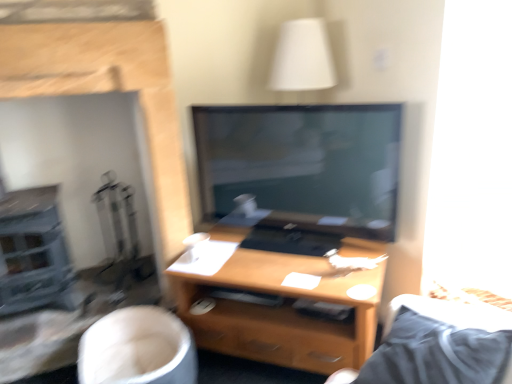
Image resolution: width=512 pixels, height=384 pixels. What are the coordinates of `white fabric swivel chair at lower left` in the screenshot? It's located at click(137, 348).

You are a GUI agent. You are given a task and a screenshot of the screen. Output one action in this format:
    pyautogui.click(x=<x>, y=<y>)
    Task: Click on the wooden desk at center
    This screenshot has width=512, height=384.
    Given the screenshot: What is the action you would take?
    pyautogui.click(x=281, y=312)

Considering the positions of points (165, 238) and (275, 328), is point (165, 238) farther from camera compared to point (275, 328)?

Yes, it is behind point (275, 328).

From a real-world perspective, is smooth stone fireplace at left above or below wooden desk at center?

From a real-world perspective, smooth stone fireplace at left is physically above wooden desk at center.

Would you consider smooth stone fireplace at left to be distant from wooden desk at center?

No, smooth stone fireplace at left is not far from wooden desk at center.

Would you say smooth stone fireplace at left is outside wooden desk at center?

Absolutely, smooth stone fireplace at left is external to wooden desk at center.

From a real-world perspective, which is physically below, wooden desk at center or smooth stone fireplace at left?

From a 3D spatial view, wooden desk at center is below.

Choose the correct answer: Is wooden desk at center inside smooth stone fireplace at left or outside it?

wooden desk at center is located beyond the bounds of smooth stone fireplace at left.

Between wooden desk at center and smooth stone fireplace at left, which one has more height?

smooth stone fireplace at left.

Where is `desk on the right of smooth stone fireplace at left`? This screenshot has height=384, width=512. desk on the right of smooth stone fireplace at left is located at coordinates (281, 312).

Between smooth stone fireplace at left and white fabric swivel chair at lower left, which one has less height?

With less height is white fabric swivel chair at lower left.

Is point (19, 34) positioned before point (170, 382)?

Yes.

How different are the orientations of smooth stone fireplace at left and white fabric swivel chair at lower left in degrees?

The angular difference between smooth stone fireplace at left and white fabric swivel chair at lower left is 1.95 degrees.

Is smooth stone fireplace at left looking in the opposite direction of white fabric swivel chair at lower left?

No, smooth stone fireplace at left's orientation is not away from white fabric swivel chair at lower left.

From a real-world perspective, is wooden desk at center positioned over white fabric swivel chair at lower left based on gravity?

Yes, from a real-world perspective, wooden desk at center is over white fabric swivel chair at lower left

Is wooden desk at center shorter than white fabric swivel chair at lower left?

No.

Is wooden desk at center located outside white fabric swivel chair at lower left?

Yes, wooden desk at center is located beyond the bounds of white fabric swivel chair at lower left.

Which object is more forward, wooden desk at center or white fabric swivel chair at lower left?

white fabric swivel chair at lower left is more forward.

Is white fabric swivel chair at lower left wider or thinner than wooden desk at center?

white fabric swivel chair at lower left is thinner than wooden desk at center.

Considering the relative sizes of white fabric swivel chair at lower left and wooden desk at center in the image provided, is white fabric swivel chair at lower left shorter than wooden desk at center?

Yes.

Considering their positions, is white fabric swivel chair at lower left located in front of or behind wooden desk at center?

white fabric swivel chair at lower left is positioned closer to the viewer than wooden desk at center.

Is white fabric swivel chair at lower left with wooden desk at center?

No.

Is white fabric swivel chair at lower left placed right next to smooth stone fireplace at left?

There is a gap between white fabric swivel chair at lower left and smooth stone fireplace at left.

Find the location of a particular element. Image resolution: width=512 pixels, height=384 pixels. fireplace that appears above the white fabric swivel chair at lower left (from a real-world perspective) is located at coordinates (109, 91).

From a real-world perspective, is white fabric swivel chair at lower left beneath smooth stone fireplace at left?

Yes, from a real-world perspective, white fabric swivel chair at lower left is below smooth stone fireplace at left.

Find the location of a particular element. The width and height of the screenshot is (512, 384). desk on the right of smooth stone fireplace at left is located at coordinates pos(281,312).

The image size is (512, 384). What are the coordinates of `desk that is below the smooth stone fireplace at left (from the image's perspective)` in the screenshot? It's located at (281, 312).

Looking at the image, which one is located further to smooth stone fireplace at left, wooden desk at center or white fabric swivel chair at lower left?

Among the two, wooden desk at center is located further to smooth stone fireplace at left.

Estimate the real-world distances between objects in this image. Which object is further from white fabric swivel chair at lower left, wooden desk at center or smooth stone fireplace at left?

Among the two, smooth stone fireplace at left is located further to white fabric swivel chair at lower left.

From the image, which object appears to be farther from wooden desk at center, white fabric swivel chair at lower left or smooth stone fireplace at left?

Among the two, smooth stone fireplace at left is located further to wooden desk at center.

From the image, which object appears to be nearer to wooden desk at center, smooth stone fireplace at left or white fabric swivel chair at lower left?

white fabric swivel chair at lower left is closer to wooden desk at center.

When comparing their distances from white fabric swivel chair at lower left, does smooth stone fireplace at left or wooden desk at center seem closer?

Based on the image, wooden desk at center appears to be nearer to white fabric swivel chair at lower left.

Based on their spatial positions, is white fabric swivel chair at lower left or wooden desk at center closer to smooth stone fireplace at left?

white fabric swivel chair at lower left lies closer to smooth stone fireplace at left than the other object.

Find the location of a particular element. The width and height of the screenshot is (512, 384). swivel chair located between smooth stone fireplace at left and wooden desk at center in the left-right direction is located at coordinates (137, 348).